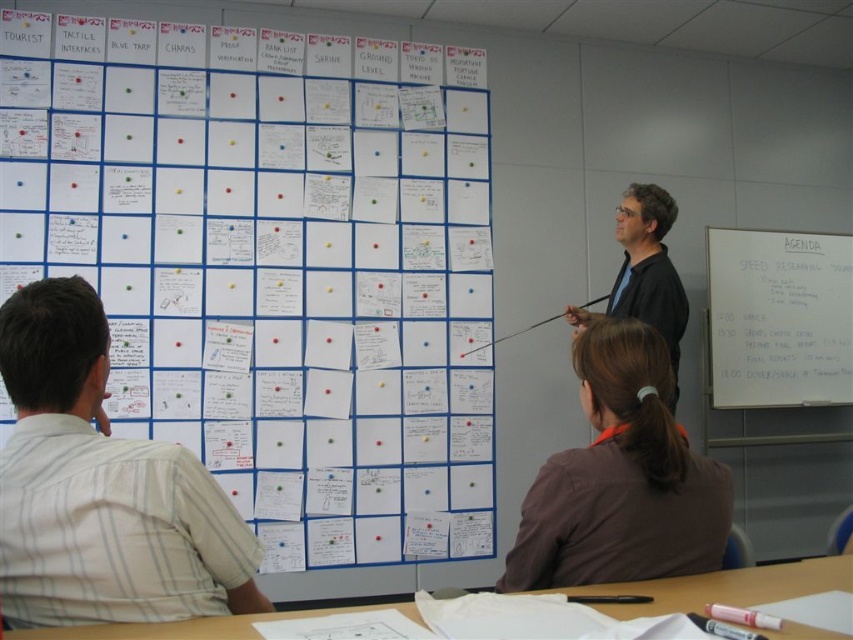
You are organizing a workshop and need to know which surface can accommodate a larger poster. Based on the scene, which one between the white paper at upper left and the whiteboard at right has a greater width?

The white paper at upper left has a greater width than the whiteboard at right, so it can accommodate a larger poster.

You are organizing a workshop and need to place a 1.2 meter wide presentation board between the whiteboard at right and the black matte shirt at center. Can the presentation board fit between them based on their widths?

The whiteboard at right is wider than the black matte shirt at center. Since the presentation board is 1.2 meters wide, it can only fit if the space between them is at least 1.2 meters. However, the description only states the whiteboard is wider than the shirt, but doesn not provide exact measurements of the space between them. Therefore, it is unclear if the presentation board will fit without additional information.